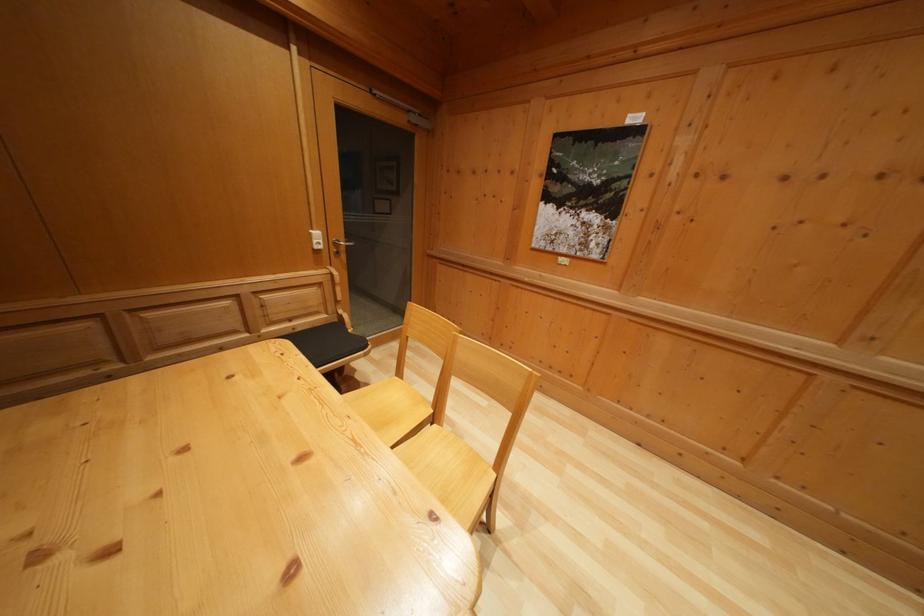
At what (x,y) coordinates should I click in order to perform the action: click on metal door handle. Please return your answer as a coordinate pair (x, y). Looking at the image, I should click on (339, 245).